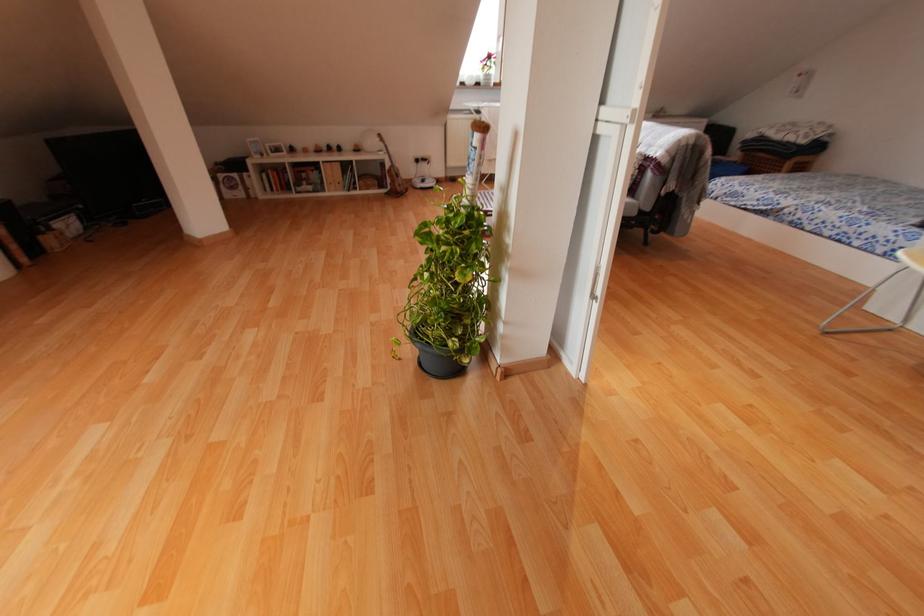
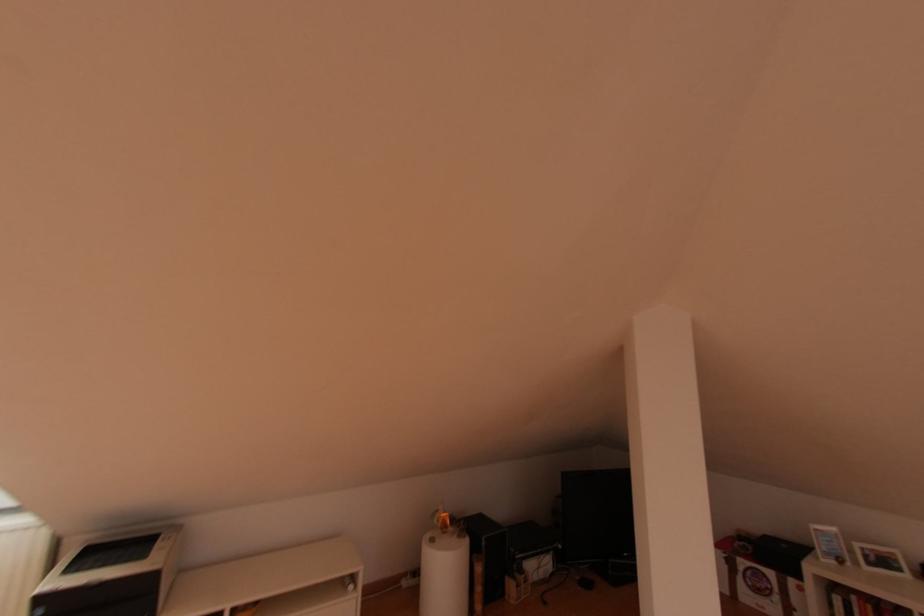
Where in the second image is the point corresponding to pixel 272 153 from the first image?

(869, 564)